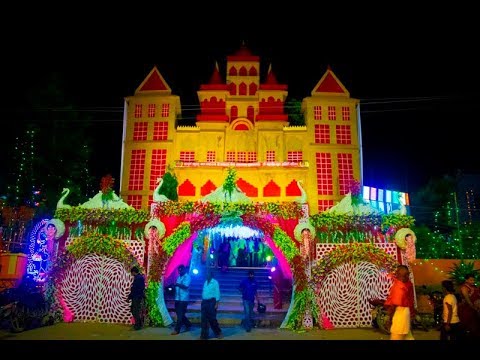
You are a GUI agent. You are given a task and a screenshot of the screen. Output one action in this format:
    pyautogui.click(x=<x>, y=<y>)
    Task: Click on the wall
    The height and width of the screenshot is (360, 480).
    Given the screenshot: What is the action you would take?
    pyautogui.click(x=131, y=114)